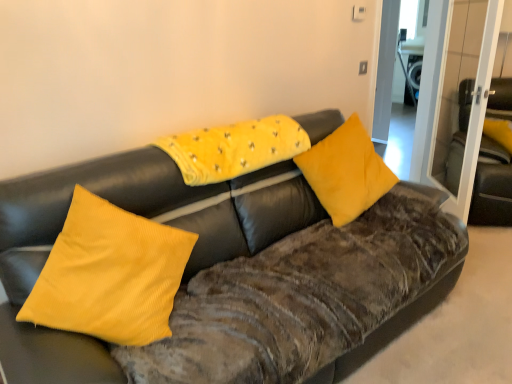
Question: Is yellow corduroy pillow at upper center, the 2th pillow when ordered from left to right, bigger or smaller than yellow corduroy pillow at left, marked as the 1th pillow in a left-to-right arrangement?

Choices:
 (A) big
 (B) small

Answer: (B)

Question: From a real-world perspective, relative to yellow corduroy pillow at left, marked as the 1th pillow in a left-to-right arrangement, is yellow corduroy pillow at upper center, the second pillow in the right-to-left sequence, vertically above or below?

Choices:
 (A) above
 (B) below

Answer: (A)

Question: Which is farther from the yellow corduroy pillow at center, which appears as the 3th pillow when viewed from the left?

Choices:
 (A) velvet black armchair at right
 (B) yellow corduroy pillow at upper center, the second pillow in the right-to-left sequence
 (C) velvet brown couch at center
 (D) yellow corduroy pillow at left, acting as the 3th pillow starting from the right
 (E) transparent glass door at upper right

Answer: (A)

Question: Which object is the farthest from the velvet brown couch at center?

Choices:
 (A) yellow corduroy pillow at upper center, the second pillow in the right-to-left sequence
 (B) velvet black armchair at right
 (C) yellow corduroy pillow at left, acting as the 3th pillow starting from the right
 (D) yellow corduroy pillow at center, acting as the 1th pillow starting from the right
 (E) transparent glass door at upper right

Answer: (B)